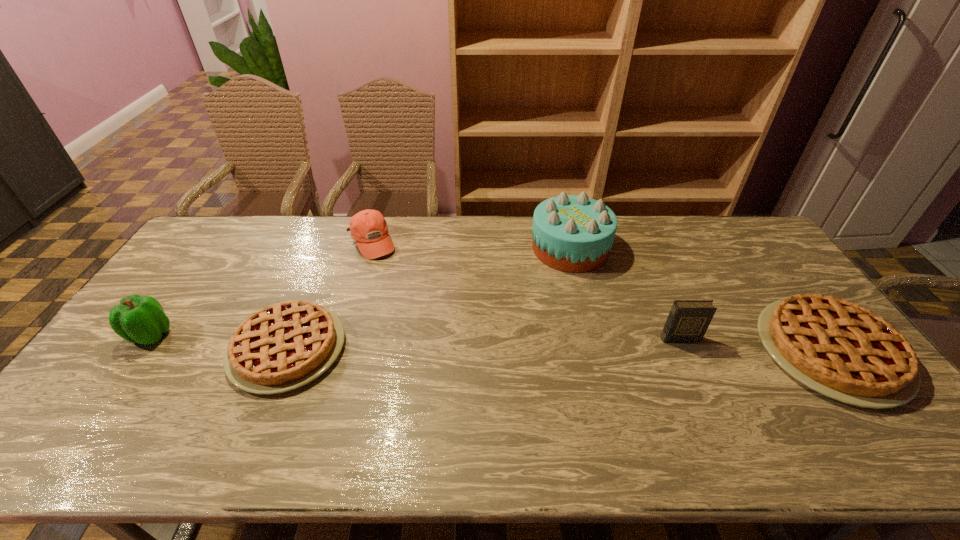
I want to click on vacant area located on the front of the cake, so click(x=586, y=310).

Identify the location of vacant region located 0.250m on the right of the baseball cap. This screenshot has width=960, height=540. (468, 242).

The image size is (960, 540). Find the location of `free space located on the back of the bell pepper`. free space located on the back of the bell pepper is located at coordinates (195, 274).

This screenshot has height=540, width=960. What are the coordinates of `vacant space located 0.170m on the front cover of the fifth object from left to right` in the screenshot? It's located at (705, 396).

The height and width of the screenshot is (540, 960). Find the location of `cake present at the far edge`. cake present at the far edge is located at coordinates (571, 233).

Locate an element on the screen. baseball cap at the far edge is located at coordinates (369, 229).

Find the location of `object located at the left edge`. object located at the left edge is located at coordinates (139, 319).

What are the coordinates of `object located in the right edge section of the desktop` in the screenshot? It's located at (839, 349).

The height and width of the screenshot is (540, 960). Find the location of `object located in the near right corner section of the desktop`. object located in the near right corner section of the desktop is located at coordinates (839, 349).

Where is `vacant space at the far edge of the desktop`? This screenshot has height=540, width=960. vacant space at the far edge of the desktop is located at coordinates (313, 246).